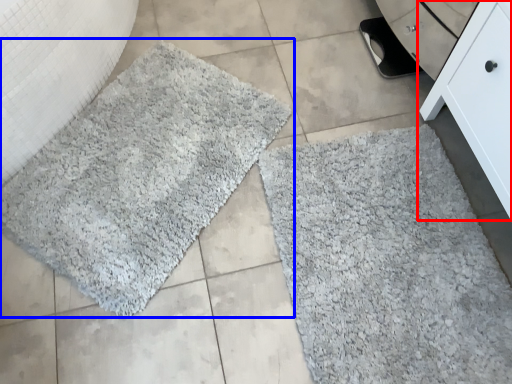
Question: Which object is further to the camera taking this photo, furniture (highlighted by a red box) or bath mat (highlighted by a blue box)?

Choices:
 (A) furniture
 (B) bath mat

Answer: (B)